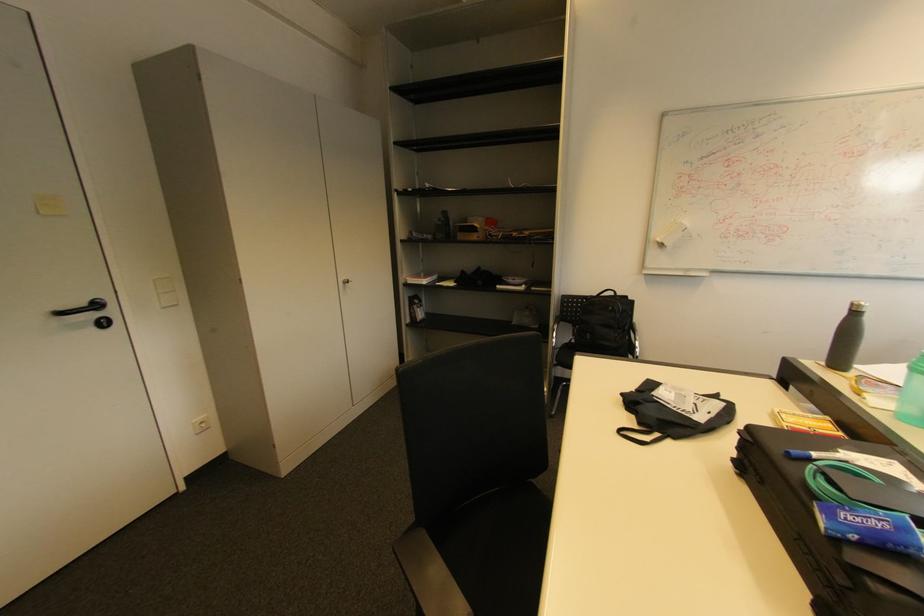
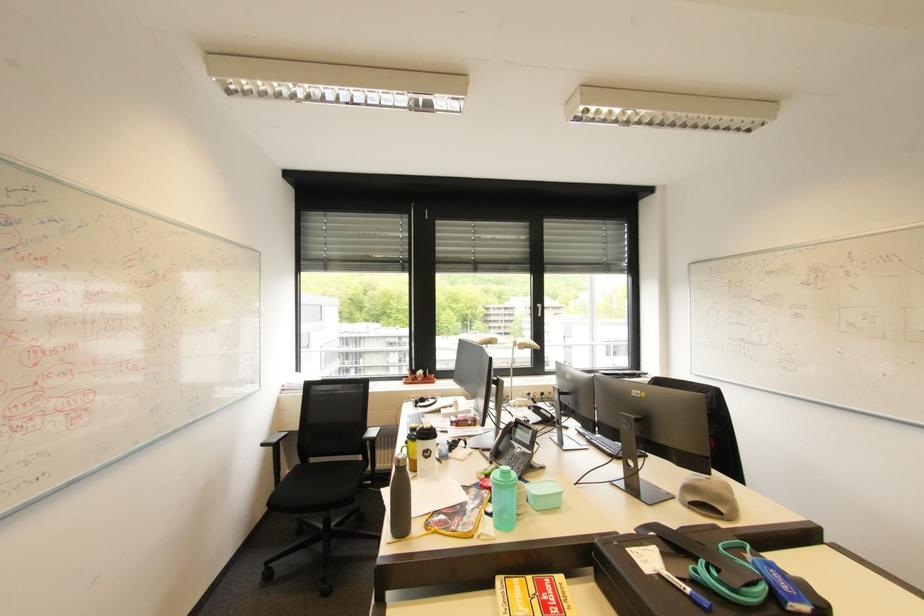
Find the pixel in the second image that matches [807,423] in the first image.

(526, 602)